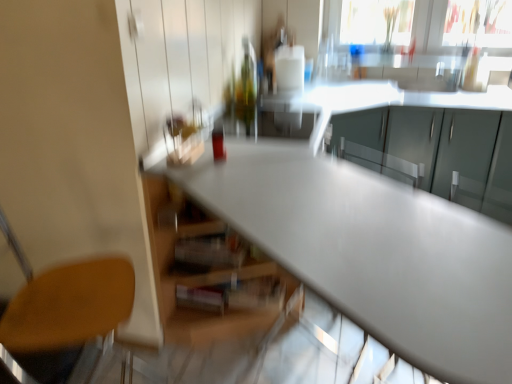
Question: Does transparent glass window screen at upper right have a smaller size compared to satin white table at center?

Choices:
 (A) yes
 (B) no

Answer: (A)

Question: Could you tell me if transparent glass window screen at upper right is turned towards satin white table at center?

Choices:
 (A) no
 (B) yes

Answer: (B)

Question: Is transparent glass window screen at upper right bigger than satin white table at center?

Choices:
 (A) no
 (B) yes

Answer: (A)

Question: From the image's perspective, is transparent glass window screen at upper right on top of satin white table at center?

Choices:
 (A) yes
 (B) no

Answer: (A)

Question: Is the position of transparent glass window screen at upper right less distant than that of satin white table at center?

Choices:
 (A) no
 (B) yes

Answer: (A)

Question: From the image's perspective, relative to satin white table at center, is matte gray cabinets at upper right above or below?

Choices:
 (A) above
 (B) below

Answer: (A)

Question: Considering the positions of point (504, 104) and point (446, 296), is point (504, 104) closer or farther from the camera than point (446, 296)?

Choices:
 (A) farther
 (B) closer

Answer: (A)

Question: Relative to satin white table at center, is matte gray cabinets at upper right in front or behind?

Choices:
 (A) front
 (B) behind

Answer: (B)

Question: From a real-world perspective, relative to satin white table at center, is matte gray cabinets at upper right vertically above or below?

Choices:
 (A) below
 (B) above

Answer: (A)

Question: From the image's perspective, is transparent glass window screen at upper right above or below matte gray cabinets at upper right?

Choices:
 (A) above
 (B) below

Answer: (A)

Question: In terms of height, does transparent glass window screen at upper right look taller or shorter compared to matte gray cabinets at upper right?

Choices:
 (A) short
 (B) tall

Answer: (A)

Question: From a real-world perspective, is transparent glass window screen at upper right above or below matte gray cabinets at upper right?

Choices:
 (A) above
 (B) below

Answer: (A)

Question: Is transparent glass window screen at upper right to the left or to the right of matte gray cabinets at upper right in the image?

Choices:
 (A) right
 (B) left

Answer: (A)

Question: From a real-world perspective, is satin white table at center physically located above or below wooden seat at lower left?

Choices:
 (A) below
 (B) above

Answer: (A)

Question: Looking at their shapes, would you say satin white table at center is wider or thinner than wooden seat at lower left?

Choices:
 (A) thin
 (B) wide

Answer: (B)